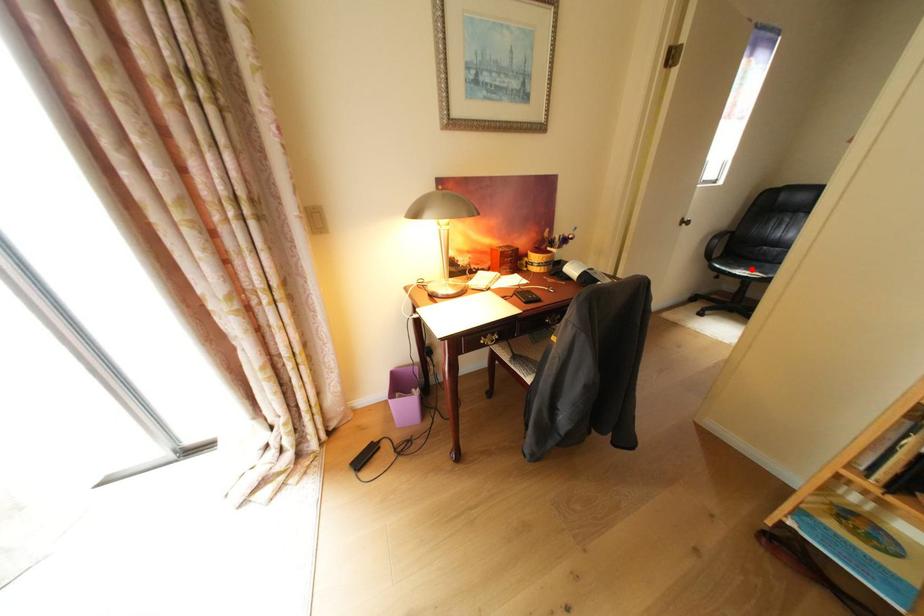
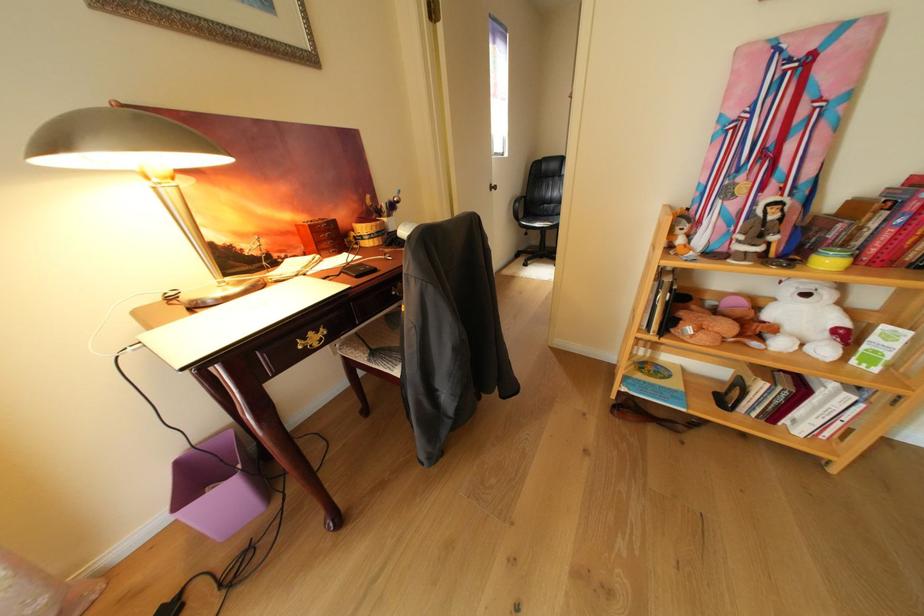
Question: A red point is marked in image1. In image2, is the corresponding 3D point closer to the camera or farther? Reply with the corresponding letter.

Choices:
 (A) The corresponding 3D point is closer.
 (B) The corresponding 3D point is farther.

Answer: (A)